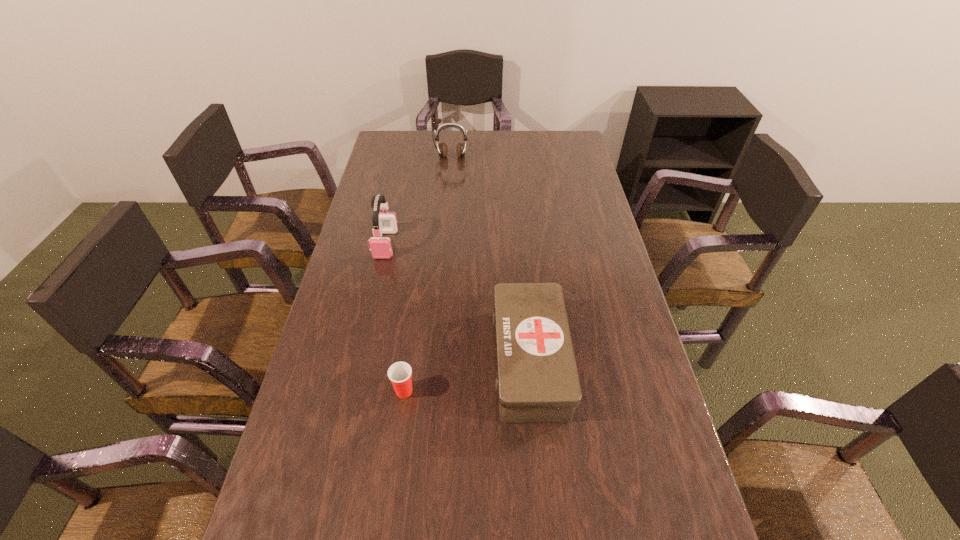
Locate an element on the screen. The width and height of the screenshot is (960, 540). the nearer earphone is located at coordinates (383, 223).

Locate an element on the screen. This screenshot has width=960, height=540. the second farthest object is located at coordinates [x=383, y=223].

Identify the location of the farther earphone. (461, 147).

At what (x,y) coordinates should I click in order to perform the action: click on the farthest object. Please return your answer as a coordinate pair (x, y). The image size is (960, 540). Looking at the image, I should click on (461, 147).

Find the location of a particular element. The width and height of the screenshot is (960, 540). the second shortest object is located at coordinates (537, 380).

Locate an element on the screen. the rightmost object is located at coordinates (537, 380).

Where is `the shortest object`? The image size is (960, 540). the shortest object is located at coordinates (399, 373).

Locate an element on the screen. free spot located on the outer surface of the nearer earphone is located at coordinates (378, 278).

I want to click on free region located on the ear pads of the farther earphone, so click(447, 207).

At what (x,y) coordinates should I click in order to perform the action: click on free space located 0.060m on the back of the first-aid kit. Please return your answer as a coordinate pair (x, y). Looking at the image, I should click on (523, 293).